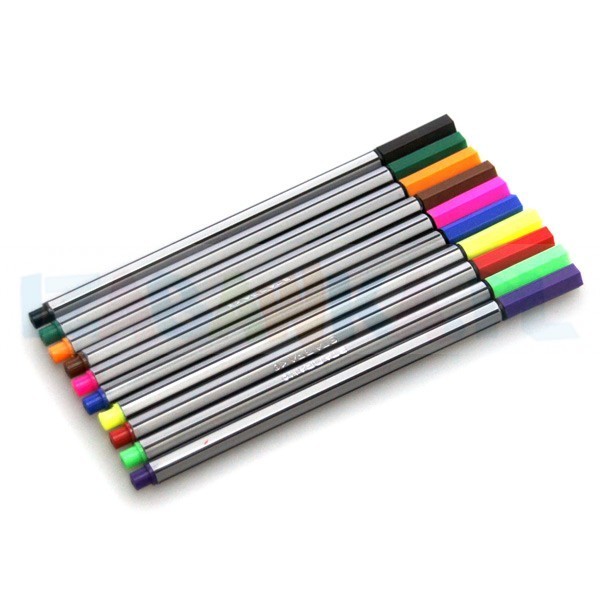
You are a GUI agent. You are given a task and a screenshot of the screen. Output one action in this format:
    pyautogui.click(x=<x>, y=<y>)
    Task: Click on the pen
    This screenshot has height=600, width=600.
    Given the screenshot: What is the action you would take?
    pyautogui.click(x=57, y=298), pyautogui.click(x=64, y=321), pyautogui.click(x=70, y=346), pyautogui.click(x=76, y=357), pyautogui.click(x=86, y=380), pyautogui.click(x=95, y=403), pyautogui.click(x=105, y=421), pyautogui.click(x=119, y=442), pyautogui.click(x=136, y=457), pyautogui.click(x=141, y=474)